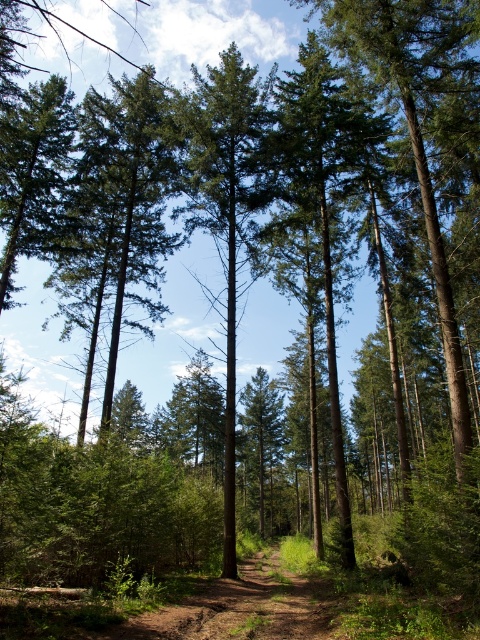
Who is more distant from viewer, (342, 236) or (230, 76)?

The point (342, 236) is behind.

Can you confirm if green rough bark tree at center is shorter than green matte tree at center?

No, green rough bark tree at center is not shorter than green matte tree at center.

In the scene shown: Measure the distance between green rough bark tree at center and camera.

green rough bark tree at center is 13.93 meters away from camera.

Where is `green rough bark tree at center`? The width and height of the screenshot is (480, 640). green rough bark tree at center is located at coordinates click(x=317, y=198).